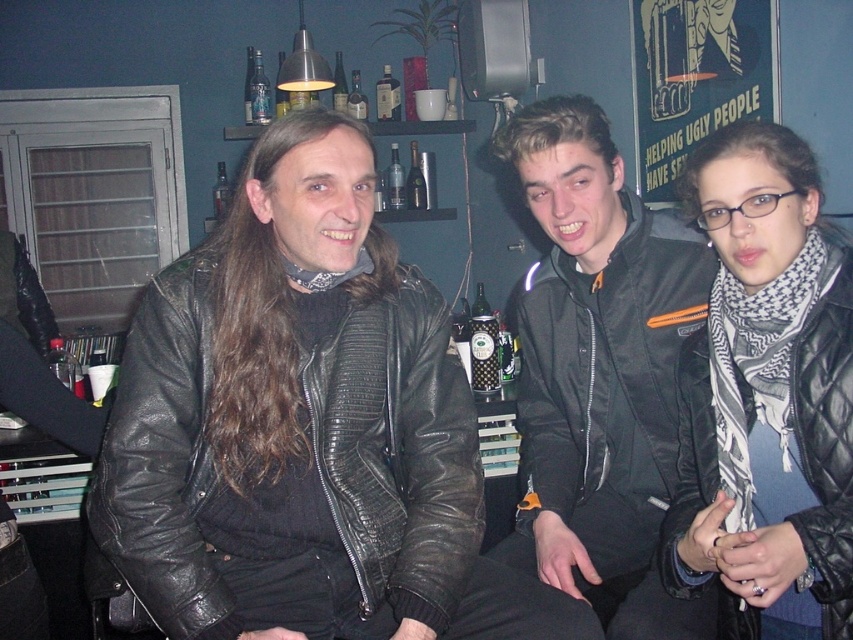
Question: From the image, what is the correct spatial relationship of black leather jacket at left in relation to black leather jacket at center?

Choices:
 (A) right
 (B) left

Answer: (B)

Question: Which object appears farthest from the camera in this image?

Choices:
 (A) black quilted jacket at center
 (B) black leather jacket at center
 (C) black leather jacket at left

Answer: (B)

Question: Which of the following is the closest to the observer?

Choices:
 (A) (173, 614)
 (B) (827, 435)

Answer: (B)

Question: Observing the image, what is the correct spatial positioning of black quilted jacket at center in reference to black leather jacket at center?

Choices:
 (A) below
 (B) above

Answer: (A)

Question: Does black leather jacket at left have a smaller size compared to black quilted jacket at center?

Choices:
 (A) yes
 (B) no

Answer: (B)

Question: Considering the real-world distances, which object is farthest from the black quilted jacket at center?

Choices:
 (A) black leather jacket at center
 (B) black leather jacket at left

Answer: (B)